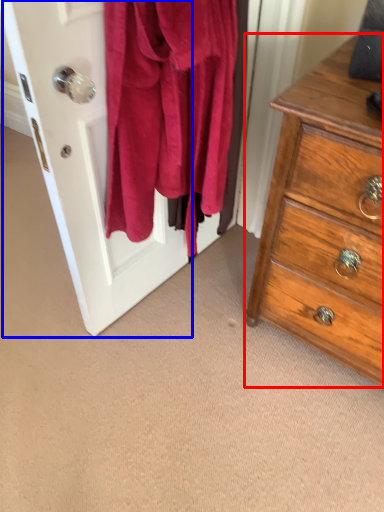
Question: Among these objects, which one is farthest to the camera, chest of drawers (highlighted by a red box) or screen door (highlighted by a blue box)?

Choices:
 (A) chest of drawers
 (B) screen door

Answer: (A)